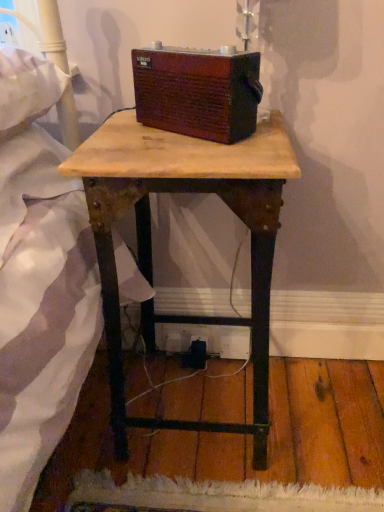
Question: Which is correct: brown wood radio at center is inside wooden table at center, or outside of it?

Choices:
 (A) outside
 (B) inside

Answer: (A)

Question: Looking at their shapes, would you say brown wood radio at center is wider or thinner than wooden table at center?

Choices:
 (A) wide
 (B) thin

Answer: (B)

Question: Looking at the image, does brown wood radio at center seem bigger or smaller compared to wooden table at center?

Choices:
 (A) big
 (B) small

Answer: (B)

Question: From the image's perspective, is wooden table at center positioned above or below brown wood radio at center?

Choices:
 (A) above
 (B) below

Answer: (B)

Question: In terms of width, does wooden table at center look wider or thinner when compared to brown wood radio at center?

Choices:
 (A) wide
 (B) thin

Answer: (A)

Question: Would you say wooden table at center is inside or outside brown wood radio at center?

Choices:
 (A) inside
 (B) outside

Answer: (B)

Question: From their relative heights in the image, would you say wooden table at center is taller or shorter than brown wood radio at center?

Choices:
 (A) short
 (B) tall

Answer: (B)